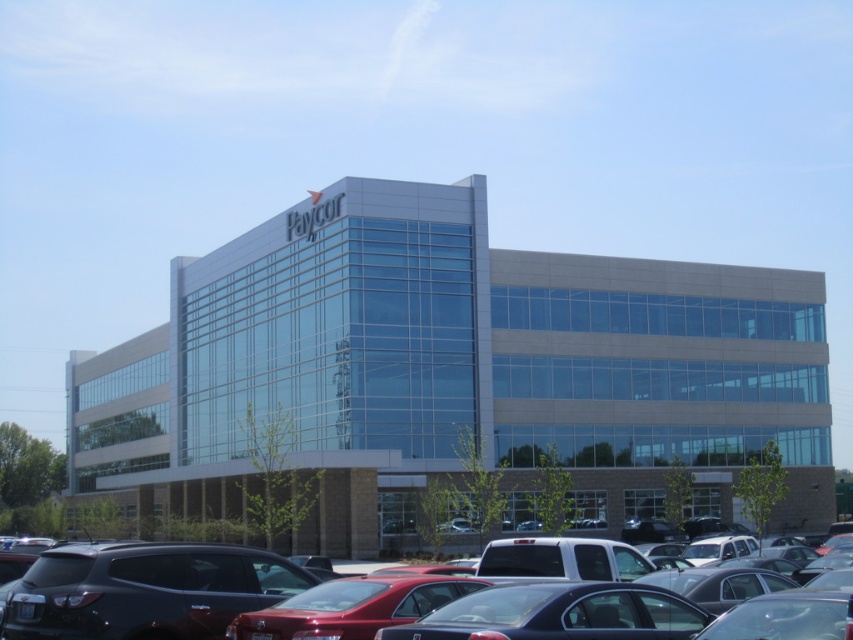
You are standing at the entrance of the Paycor office building and want to locate your car, which is the matte black sedan at center. According to the parking lot layout, where should you head to find it?

The matte black sedan at center is located at point (204, 593), so you should head towards the coordinates (204, 593) in the parking lot to find it.

You are a delivery person arriving at the Paycor office building. You need to park your vehicle between the two cars present in the scene. However, you notice that there is limited space between the matte black sedan at center and the glossy black suv at lower left. Can you safely maneuver your delivery van, which is 2 meters wide, between them?

The matte black sedan at center is in front of the glossy black suv at lower left, meaning there is not enough space between them for the delivery van to maneuver safely. You should look for another parking spot.

You are a delivery driver who needs to park your truck, which is 2 meters wide, in the parking lot near the Paycor building. Can you fit your truck between the matte black sedan at center and the glossy black suv at lower left?

The matte black sedan at center might be wider than glossy black suv at lower left, so there is uncertainty about the available space. If the sedan is indeed wider, the space between them may be insufficient for a 2 meter wide truck. It is recommended to measure the space or choose a different parking spot to ensure safety.